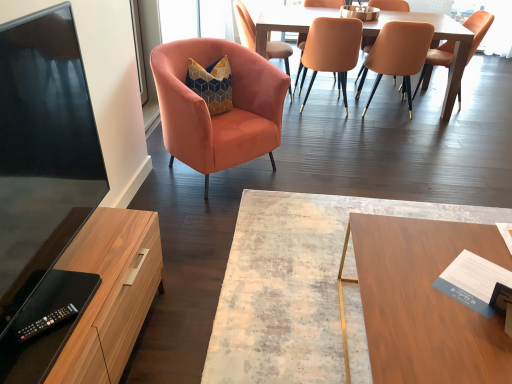
I want to click on vacant space that is in between matte orange chair at center, placed as the 3th chair when sorted from right to left, and wooden rectangular table at center, so click(361, 157).